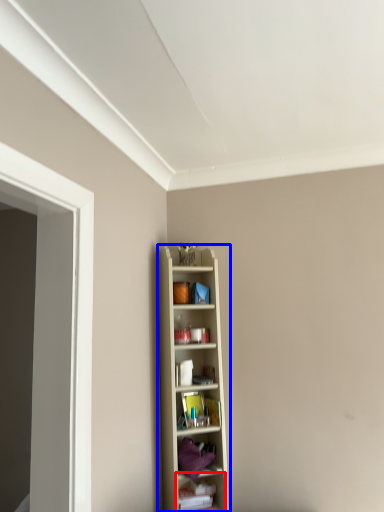
Question: Which object appears closest to the camera in this image, shelf (highlighted by a red box) or shelf (highlighted by a blue box)?

Choices:
 (A) shelf
 (B) shelf

Answer: (B)